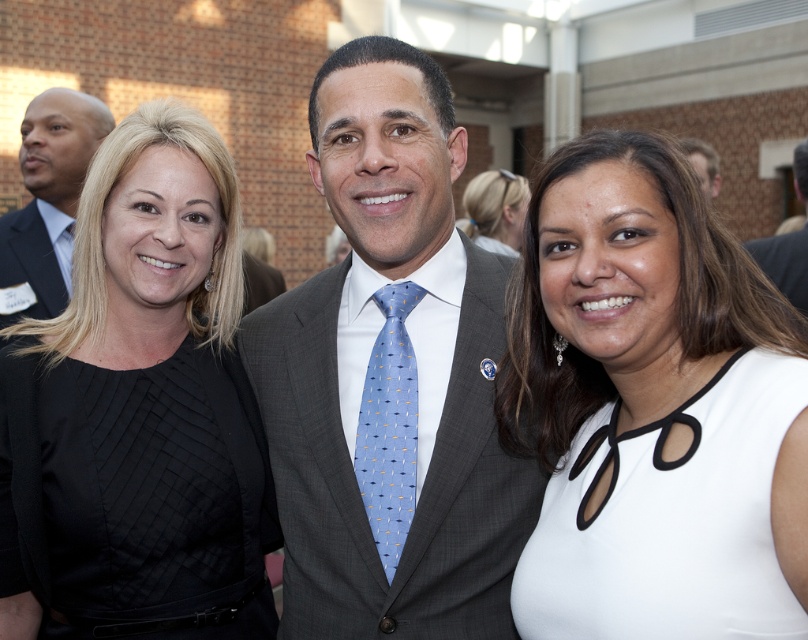
Does black pleated dress at left have a smaller size compared to light brown hair at center?

No, black pleated dress at left is not smaller than light brown hair at center.

Does black pleated dress at left appear over light brown hair at center?

Actually, black pleated dress at left is below light brown hair at center.

Image resolution: width=808 pixels, height=640 pixels. In order to click on black pleated dress at left in this screenshot , I will do `click(139, 412)`.

Where is `black pleated dress at left`? black pleated dress at left is located at coordinates (139, 412).

Between black pleated dress at left and matte black suit at left, which one has less height?

matte black suit at left

Does point (131, 328) lie behind point (45, 316)?

No, (131, 328) is in front of (45, 316).

Is point (150, 108) positioned before point (60, 140)?

Yes, it is in front of point (60, 140).

What are the coordinates of `black pleated dress at left` in the screenshot? It's located at coord(139,412).

Is point (394, 452) farther from camera compared to point (478, 227)?

No, (394, 452) is closer to viewer.

Who is more forward, (377, 536) or (512, 225)?

Positioned in front is point (377, 536).

This screenshot has width=808, height=640. I want to click on light blue silk tie at center, so click(x=389, y=426).